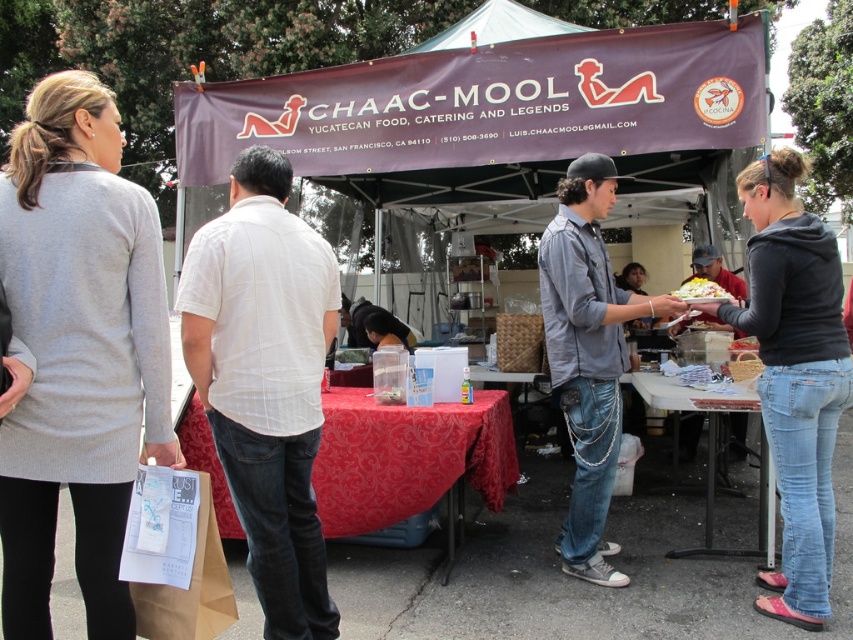
Can you confirm if denim jeans at center is positioned below wooden table at lower center?

No.

Is point (566, 371) positioned in front of point (705, 499)?

That is True.

The width and height of the screenshot is (853, 640). In order to click on denim jeans at center in this screenshot , I will do `click(589, 355)`.

Consider the image. Can you confirm if white cotton shirt at center is taller than wooden table at lower center?

Correct, white cotton shirt at center is much taller as wooden table at lower center.

Find the location of a particular element. The image size is (853, 640). white cotton shirt at center is located at coordinates (265, 380).

Can you confirm if denim jeans at center is wider than red damask tablecloth at center?

Incorrect, denim jeans at center's width does not surpass red damask tablecloth at center's.

Is denim jeans at center above red damask tablecloth at center?

Correct, denim jeans at center is located above red damask tablecloth at center.

Image resolution: width=853 pixels, height=640 pixels. What are the coordinates of `denim jeans at center` in the screenshot? It's located at (589, 355).

The height and width of the screenshot is (640, 853). I want to click on denim jeans at center, so click(x=589, y=355).